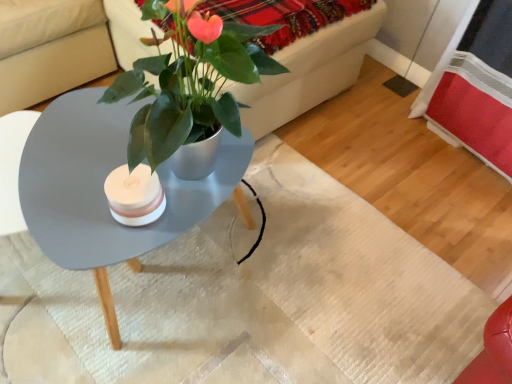
Find the location of `blank space situated above matte gray coffee table at center (from a real-world perspective)`. blank space situated above matte gray coffee table at center (from a real-world perspective) is located at coordinates (96, 162).